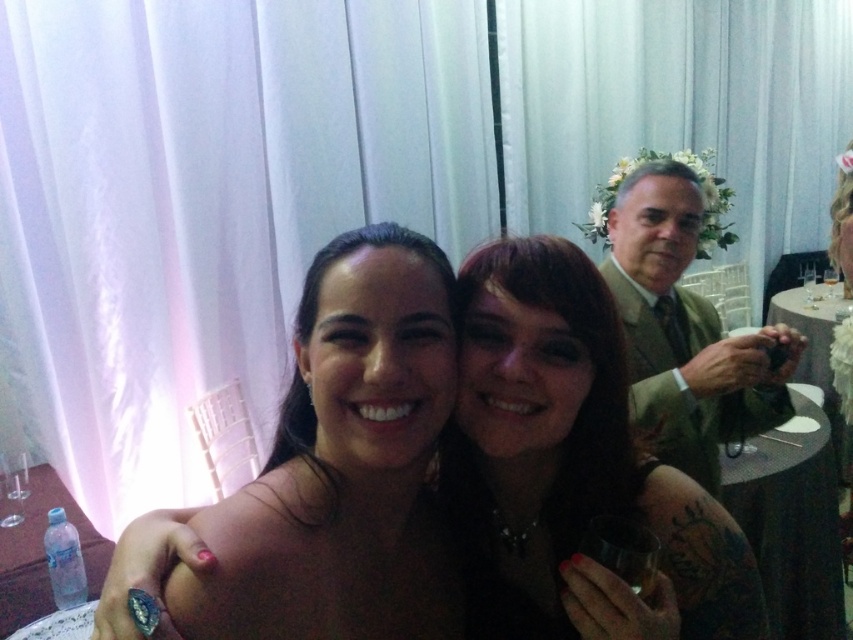
Question: Which point appears farthest from the camera in this image?

Choices:
 (A) (809, 410)
 (B) (349, 560)
 (C) (805, 276)

Answer: (C)

Question: Based on their relative distances, which object is nearer to the white glossy table at right?

Choices:
 (A) transparent glass at lower left
 (B) matte black hair at center
 (C) smooth skin at center

Answer: (B)

Question: Estimate the real-world distances between objects in this image. Which object is farther from the matte black hair at center?

Choices:
 (A) smooth skin at center
 (B) wooden table at lower right
 (C) clear plastic bottle at lower left

Answer: (C)

Question: Considering the relative positions of clear plastic bottle at lower left and transparent glass at lower left in the image provided, where is clear plastic bottle at lower left located with respect to transparent glass at lower left?

Choices:
 (A) right
 (B) left

Answer: (A)

Question: Can you confirm if smooth skin at center is smaller than transparent glass at upper right?

Choices:
 (A) yes
 (B) no

Answer: (B)

Question: Is matte black hair at center above green textured suit at upper right?

Choices:
 (A) yes
 (B) no

Answer: (B)